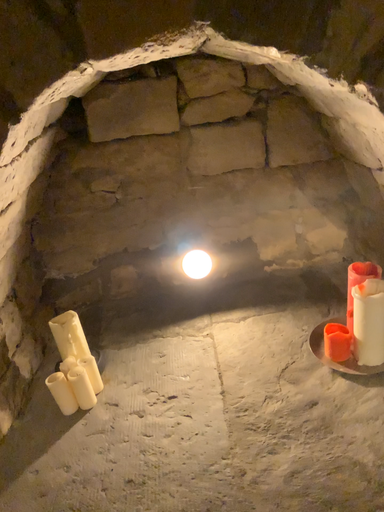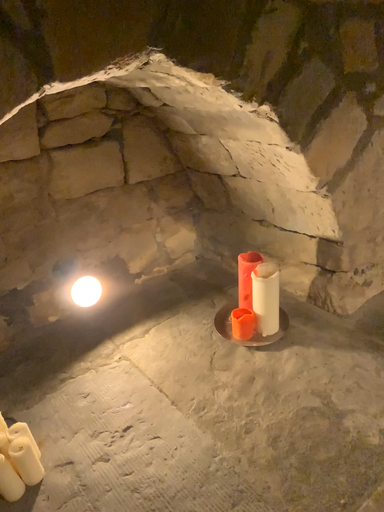
Question: How did the camera likely rotate when shooting the video?

Choices:
 (A) rotated upward
 (B) rotated downward

Answer: (A)